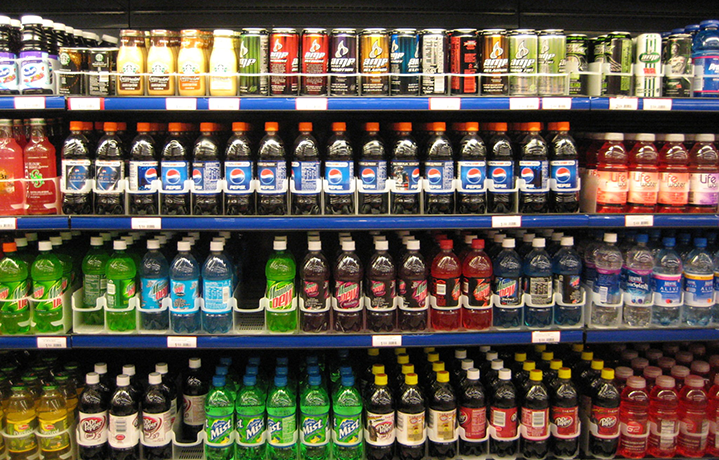
You are a GUI agent. You are given a task and a screenshot of the screen. Output one action in this format:
    pyautogui.click(x=<x>, y=<y>)
    Task: Click on the bottled teas
    Image resolution: width=719 pixels, height=460 pixels.
    Given the screenshot: What is the action you would take?
    pyautogui.click(x=49, y=414), pyautogui.click(x=65, y=385), pyautogui.click(x=75, y=375), pyautogui.click(x=50, y=360), pyautogui.click(x=45, y=371), pyautogui.click(x=27, y=385), pyautogui.click(x=19, y=412)